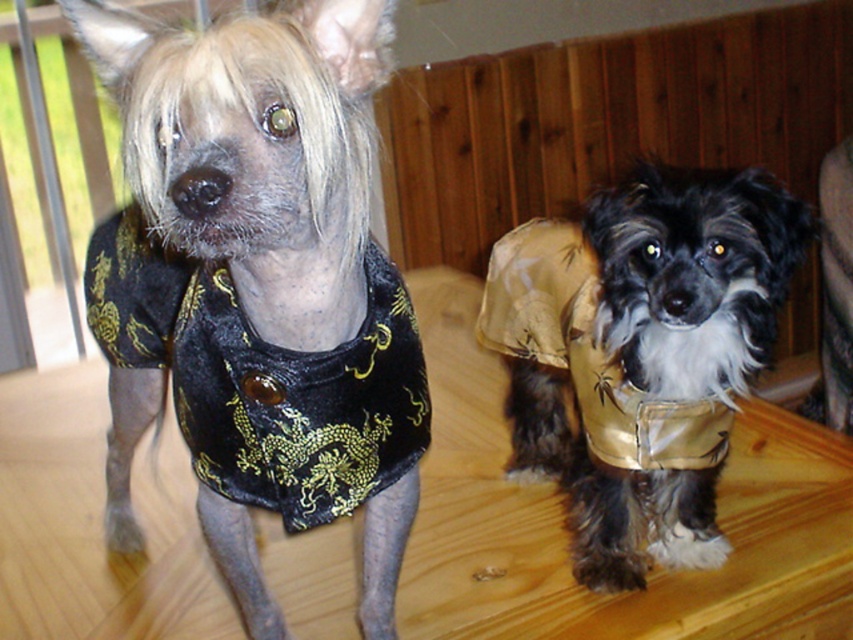
Can you confirm if gold satin vest at center is smaller than velvet/black dress at left?

No.

The width and height of the screenshot is (853, 640). What do you see at coordinates (641, 353) in the screenshot?
I see `gold satin vest at center` at bounding box center [641, 353].

Between point (666, 486) and point (137, 236), which one is positioned behind?

Point (666, 486)

Locate an element on the screen. This screenshot has width=853, height=640. gold satin vest at center is located at coordinates (641, 353).

Is the position of velvet black shirt at left more distant than that of gold satin vest at center?

No.

Does velvet black shirt at left have a lesser height compared to gold satin vest at center?

Incorrect, velvet black shirt at left's height does not fall short of gold satin vest at center's.

What are the coordinates of `velvet black shirt at left` in the screenshot? It's located at (257, 285).

Where is `velvet black shirt at left`? The height and width of the screenshot is (640, 853). velvet black shirt at left is located at coordinates (257, 285).

Where is `velvet black shirt at left`? The image size is (853, 640). velvet black shirt at left is located at coordinates (257, 285).

Is velvet black shirt at left above velvet/black dress at left?

No, velvet black shirt at left is not above velvet/black dress at left.

Between point (352, 253) and point (398, 365), which one is positioned behind?

Positioned behind is point (398, 365).

Locate an element on the screen. This screenshot has width=853, height=640. velvet black shirt at left is located at coordinates (257, 285).